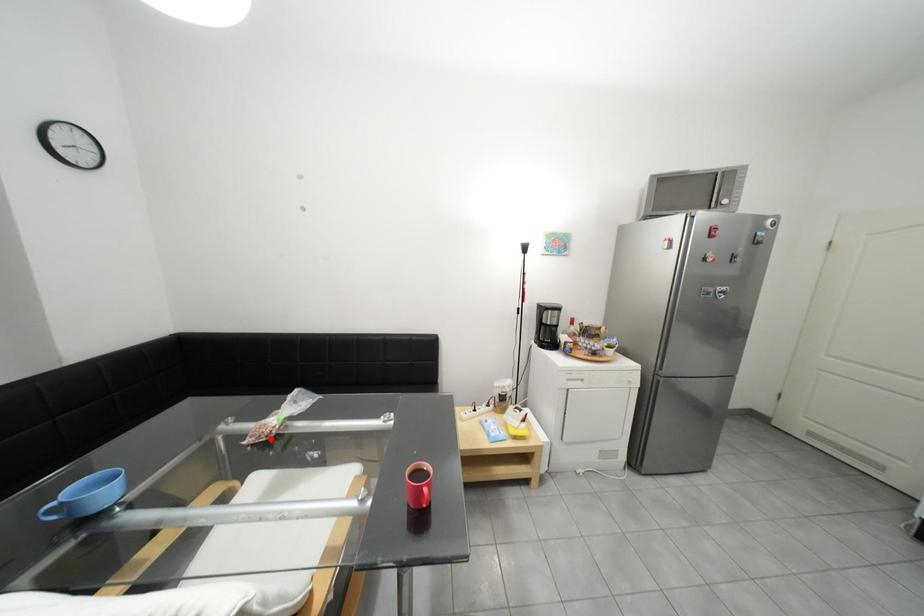
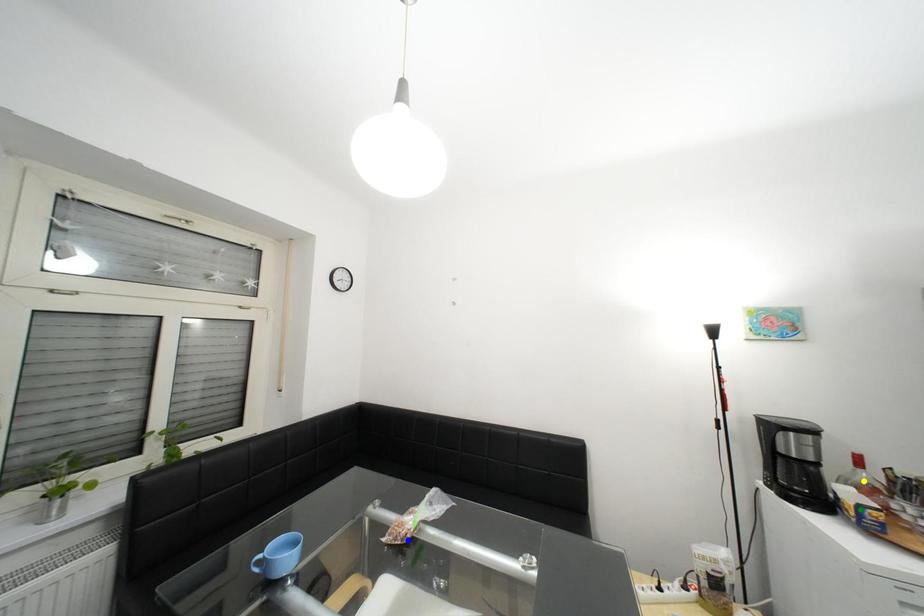
Question: I am providing you with two images of the same scene from different viewpoints. A red point is marked on the first image. You are given multiple points on the second image. Can you choose the point in image 2 that corresponds to the point in image 1?

Choices:
 (A) blue point
 (B) green point
 (C) yellow point

Answer: (A)